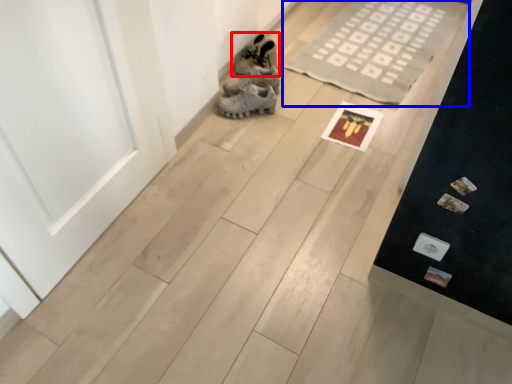
Question: Which object is further to the camera taking this photo, footwear (highlighted by a red box) or doormat (highlighted by a blue box)?

Choices:
 (A) footwear
 (B) doormat

Answer: (A)